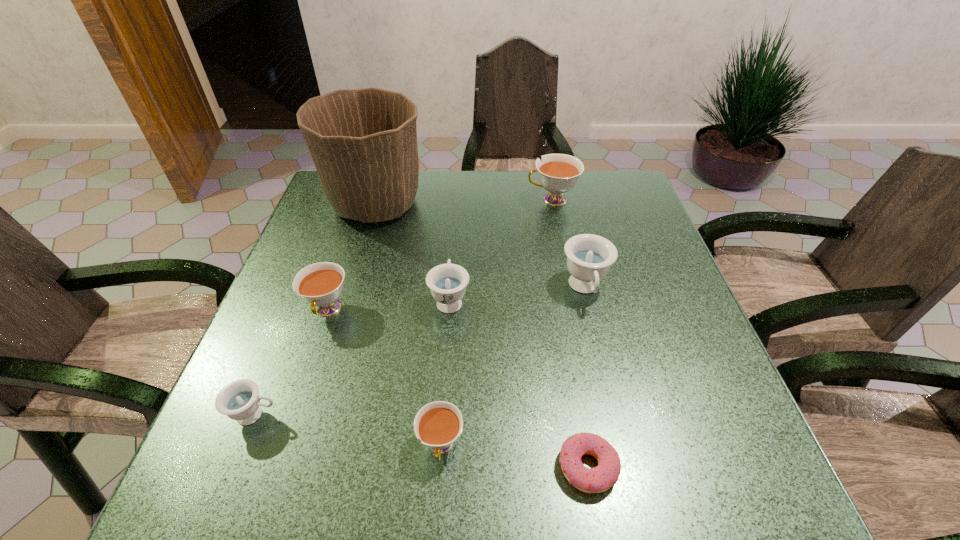
At what (x,y) coordinates should I click in order to perform the action: click on the nearest blue teacup. Please return your answer as a coordinate pair (x, y). This screenshot has height=540, width=960. Looking at the image, I should click on coord(239,400).

At what (x,y) coordinates should I click in order to perform the action: click on pink doughnut. Please return your answer as a coordinate pair (x, y). Looking at the image, I should click on (600, 478).

Where is `the shortest object`? The image size is (960, 540). the shortest object is located at coordinates (600, 478).

The width and height of the screenshot is (960, 540). In order to click on blank space located on the right of the flowerpot in this screenshot , I will do `click(462, 204)`.

Image resolution: width=960 pixels, height=540 pixels. Identify the location of vacant space situated 0.150m on the side of the farthest teacup with the handle. (474, 200).

Where is `free region located on the side of the farthest teacup with the handle`? The image size is (960, 540). free region located on the side of the farthest teacup with the handle is located at coordinates (388, 200).

Find the location of a particular element. The width and height of the screenshot is (960, 540). free spot located on the side of the farthest teacup with the handle is located at coordinates pos(453,200).

Where is `free spot located 0.390m on the side of the biggest blue teacup with the handle`? The width and height of the screenshot is (960, 540). free spot located 0.390m on the side of the biggest blue teacup with the handle is located at coordinates (636, 503).

Where is `vacant space located 0.280m on the side of the second biggest white teacup with the handle`? vacant space located 0.280m on the side of the second biggest white teacup with the handle is located at coordinates (276, 465).

Locate an element on the screen. This screenshot has height=540, width=960. blank space located on the side of the second blue teacup from right to left with the handle is located at coordinates (452, 261).